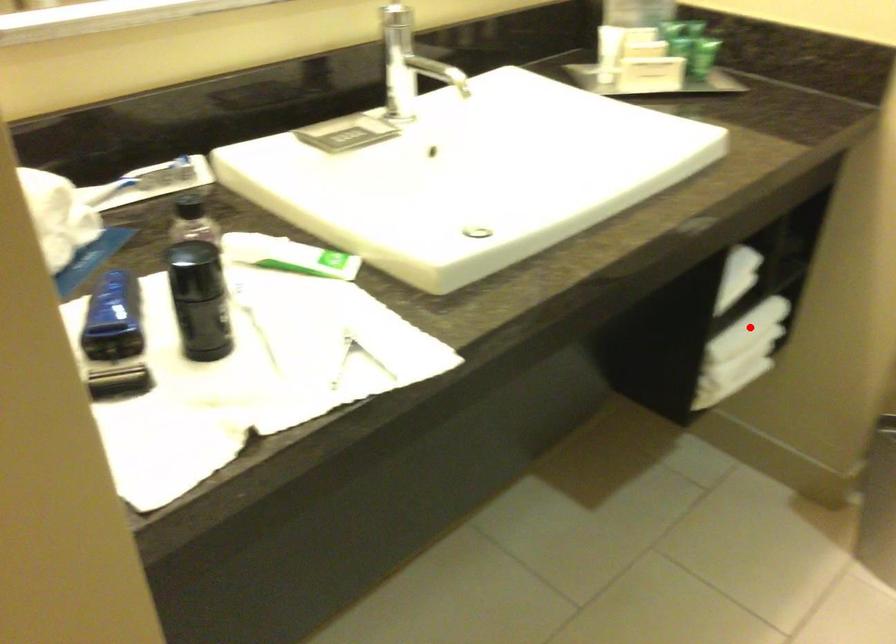
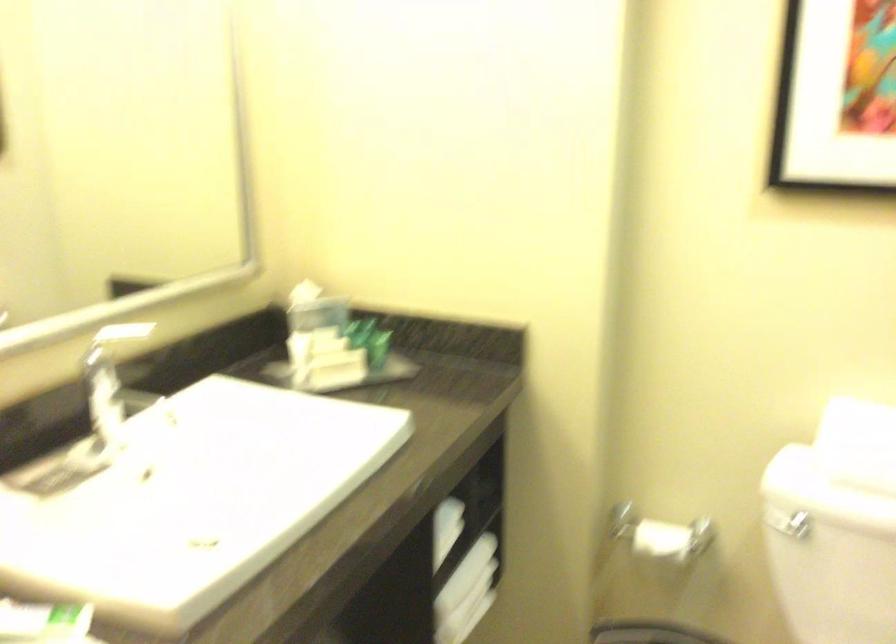
Locate, in the second image, the point that corresponds to the highlighted location in the first image.

(464, 574)